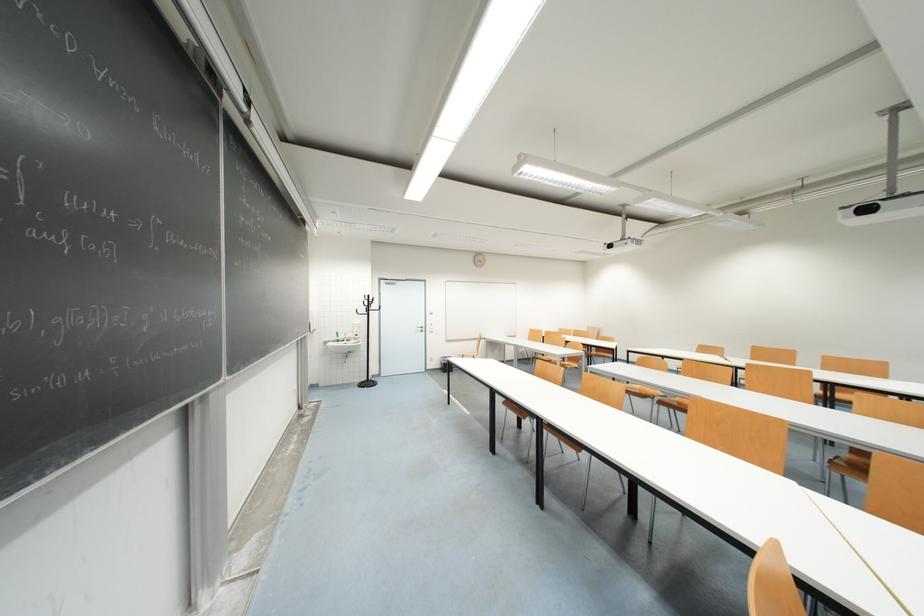
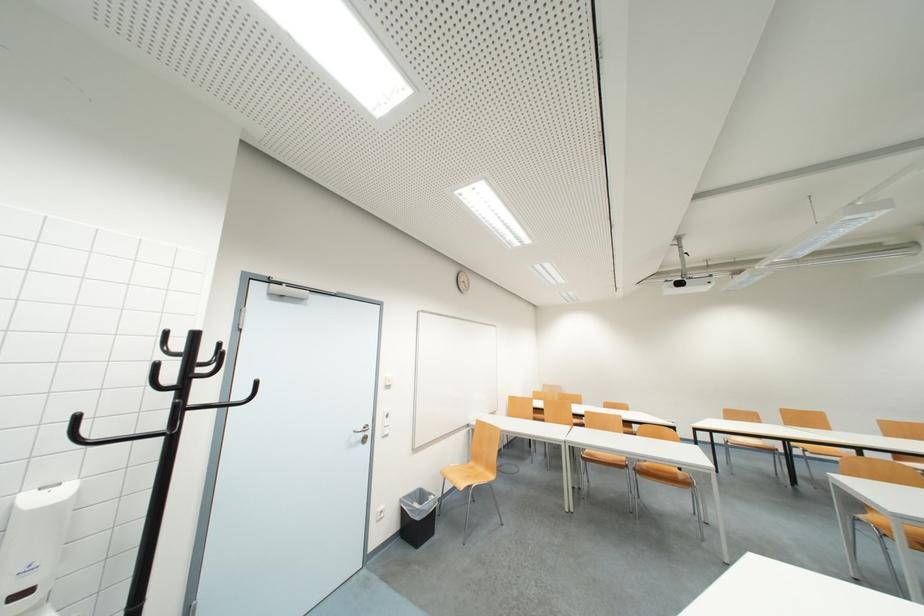
In the second image, find the point that corresponds to the point at 373,304 in the first image.

(195, 367)